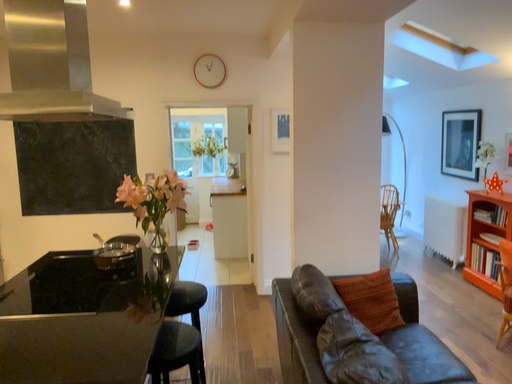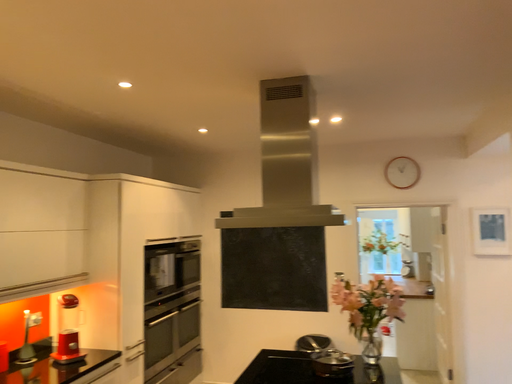
Question: Which way did the camera rotate in the video?

Choices:
 (A) rotated left
 (B) rotated right

Answer: (A)